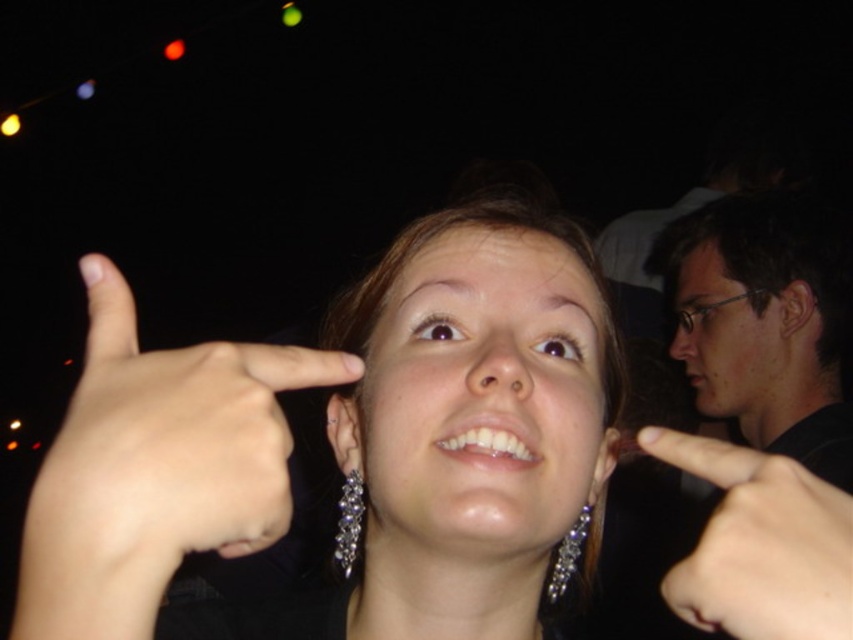
You are a photographer trying to capture the perfect shot of the woman in the scene. You need to decide which object to focus on first between the silver metallic earrings at center and the black matte glasses at upper right. Based on their sizes, which object should you prioritize focusing on first?

The silver metallic earrings at center is smaller than the black matte glasses at upper right, so you should prioritize focusing on the black matte glasses at upper right first since larger objects are easier to focus on initially.